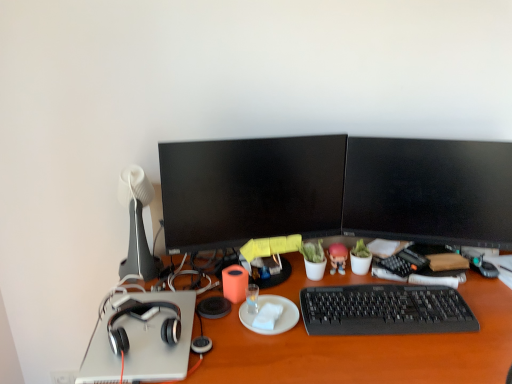
Locate an element on the screen. The width and height of the screenshot is (512, 384). blank space to the left of white matte notepad at center is located at coordinates (220, 321).